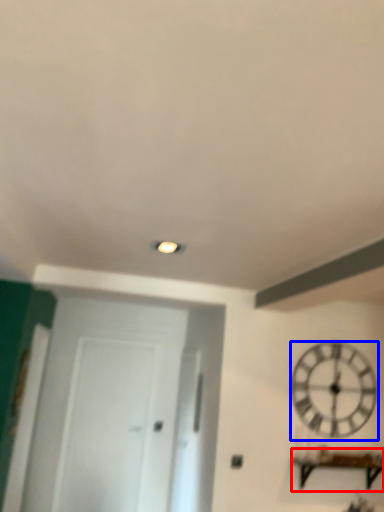
Question: Among these objects, which one is nearest to the camera, furniture (highlighted by a red box) or wall clock (highlighted by a blue box)?

Choices:
 (A) furniture
 (B) wall clock

Answer: (A)